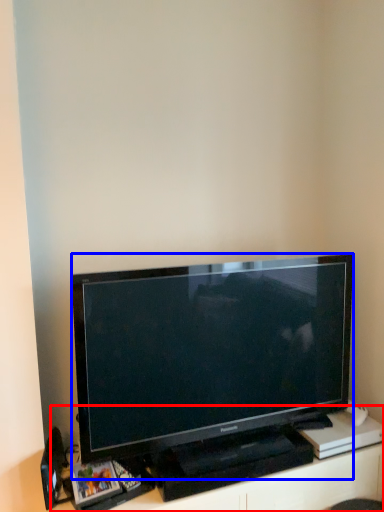
Question: Among these objects, which one is farthest to the camera, entertainment center (highlighted by a red box) or television (highlighted by a blue box)?

Choices:
 (A) entertainment center
 (B) television

Answer: (A)